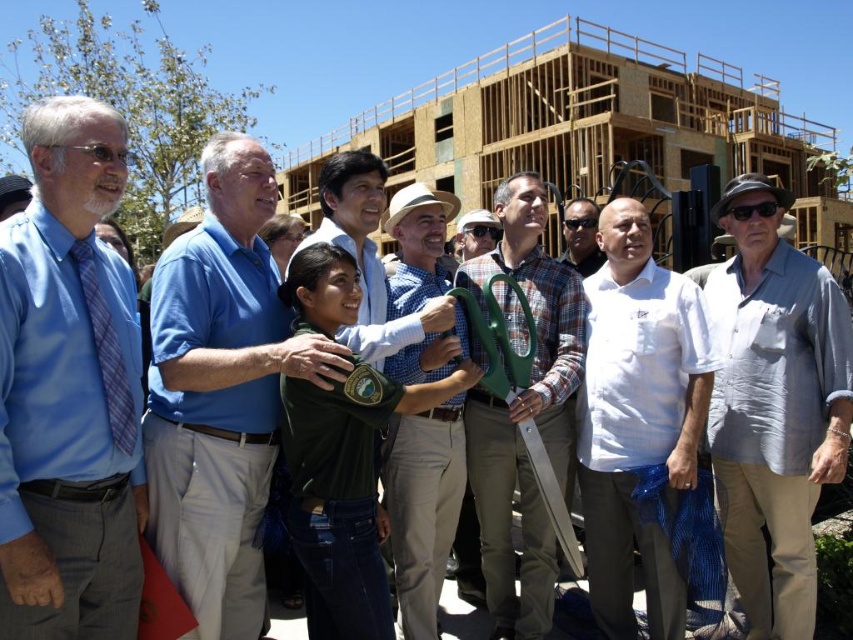
You are organizing a photo shoot and need to ensure that the blue silk shirt at left and the matte blue shirt at center are visible in the final image. Given their sizes, which shirt should you position closer to the camera to make them appear equally sized in the photo?

The blue silk shirt at left is bigger than the matte blue shirt at center. To make them appear equally sized in the photo, position the smaller matte blue shirt at center closer to the camera than the larger blue silk shirt at left.

You are organizing a photo shoot and need to ensure that the blue silk shirt at left and the white cotton shirt at center are visible in the frame. Given their sizes, which shirt might require more space to accommodate its width?

The white cotton shirt at center requires more space because its width is greater than the blue silk shirt at left.

What is the color of the shirt worn by the person located at coordinate point (68, 388)?

The blue silk shirt at left is represented by point (68, 388), so the color is blue.